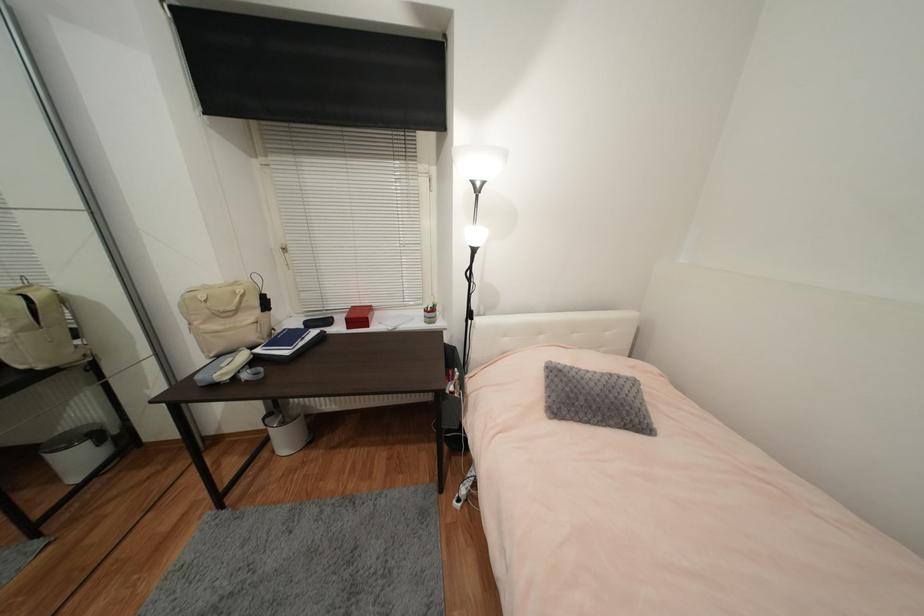
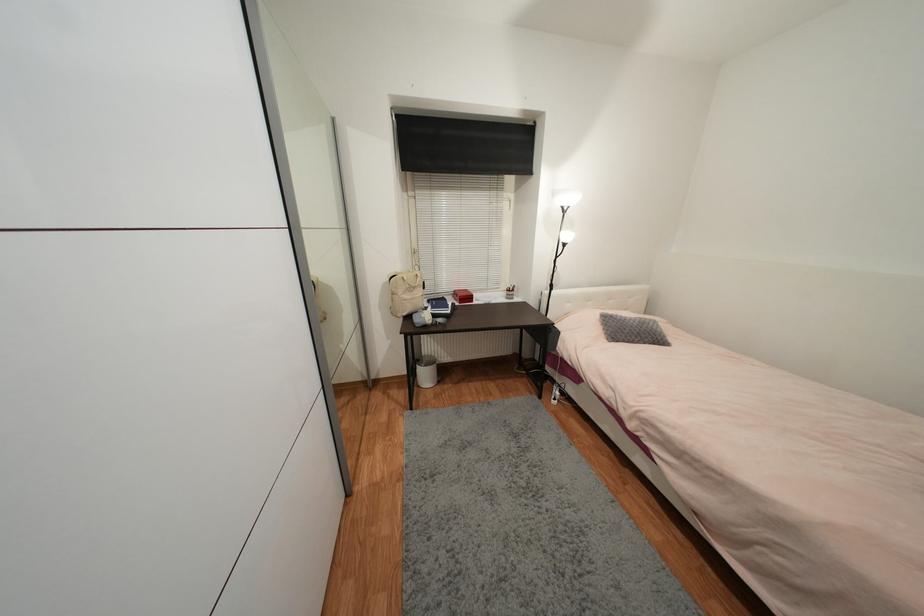
Find the pixel in the second image that matches (x=240, y=285) in the first image.

(412, 273)